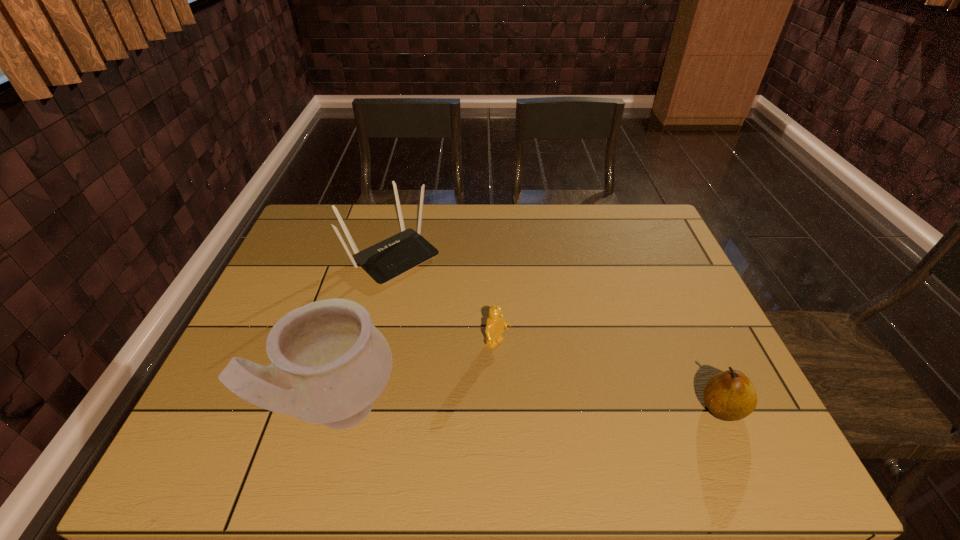
This screenshot has height=540, width=960. Find the location of `free space on the desktop that is between the pottery and the pear and is positioned on the face of the Lego`. free space on the desktop that is between the pottery and the pear and is positioned on the face of the Lego is located at coordinates (586, 409).

Locate an element on the screen. This screenshot has height=540, width=960. free space on the desktop that is between the pottery and the rightmost object and is positioned on the front-facing side of the router is located at coordinates (576, 409).